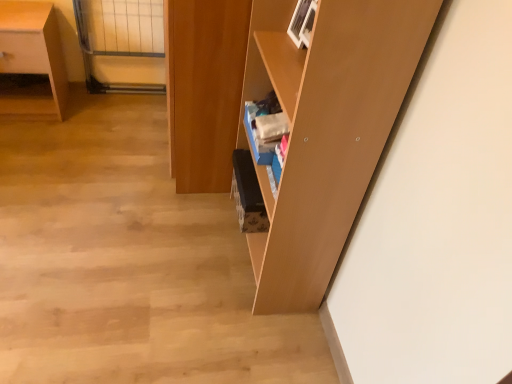
The height and width of the screenshot is (384, 512). What are the coordinates of `free point in front of clear glass door at upper left` in the screenshot? It's located at (112, 115).